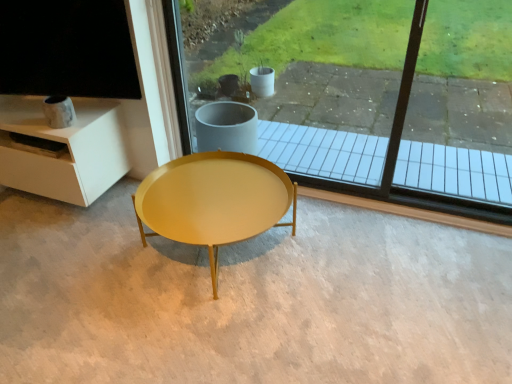
Question: Is matte yellow table at center aimed at transparent glass window at center?

Choices:
 (A) yes
 (B) no

Answer: (B)

Question: Does matte yellow table at center have a lesser height compared to transparent glass window at center?

Choices:
 (A) no
 (B) yes

Answer: (B)

Question: From a real-world perspective, is matte yellow table at center on top of transparent glass window at center?

Choices:
 (A) yes
 (B) no

Answer: (B)

Question: Can you confirm if matte yellow table at center is bigger than transparent glass window at center?

Choices:
 (A) yes
 (B) no

Answer: (A)

Question: Can you confirm if matte yellow table at center is taller than transparent glass window at center?

Choices:
 (A) yes
 (B) no

Answer: (B)

Question: Is matte yellow table at center positioned behind transparent glass window at center?

Choices:
 (A) no
 (B) yes

Answer: (A)

Question: Is transparent glass window at center turned away from matte yellow table at center?

Choices:
 (A) no
 (B) yes

Answer: (A)

Question: Considering the relative sizes of transparent glass window at center and matte yellow table at center in the image provided, is transparent glass window at center wider than matte yellow table at center?

Choices:
 (A) no
 (B) yes

Answer: (A)

Question: Does transparent glass window at center appear on the left side of matte yellow table at center?

Choices:
 (A) no
 (B) yes

Answer: (A)

Question: Is transparent glass window at center surrounding matte yellow table at center?

Choices:
 (A) yes
 (B) no

Answer: (B)

Question: From a real-world perspective, is transparent glass window at center below matte yellow table at center?

Choices:
 (A) yes
 (B) no

Answer: (B)

Question: Does transparent glass window at center turn towards matte yellow table at center?

Choices:
 (A) yes
 (B) no

Answer: (A)

Question: Considering their positions, is matte yellow table at center located in front of or behind transparent glass window at center?

Choices:
 (A) front
 (B) behind

Answer: (A)